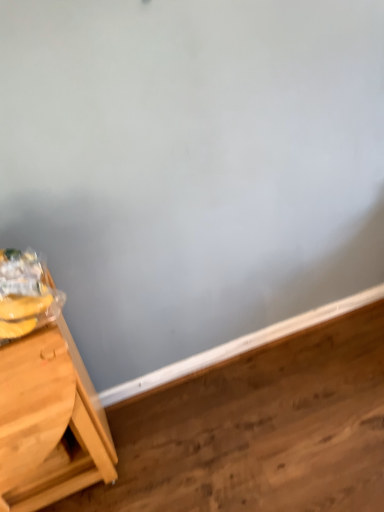
Question: Considering the positions of point (16, 386) and point (301, 439), is point (16, 386) closer or farther from the camera than point (301, 439)?

Choices:
 (A) farther
 (B) closer

Answer: (B)

Question: From a real-world perspective, is light brown wooden table at left physically located above or below wooden at lower left?

Choices:
 (A) below
 (B) above

Answer: (B)

Question: Would you say light brown wooden table at left is inside or outside wooden at lower left?

Choices:
 (A) inside
 (B) outside

Answer: (B)

Question: Considering the positions of wooden at lower left and light brown wooden table at left in the image, is wooden at lower left taller or shorter than light brown wooden table at left?

Choices:
 (A) short
 (B) tall

Answer: (A)

Question: Relative to light brown wooden table at left, is wooden at lower left in front or behind?

Choices:
 (A) behind
 (B) front

Answer: (A)

Question: From a real-world perspective, is wooden at lower left physically located above or below light brown wooden table at left?

Choices:
 (A) above
 (B) below

Answer: (B)

Question: Is wooden at lower left situated inside light brown wooden table at left or outside?

Choices:
 (A) inside
 (B) outside

Answer: (B)